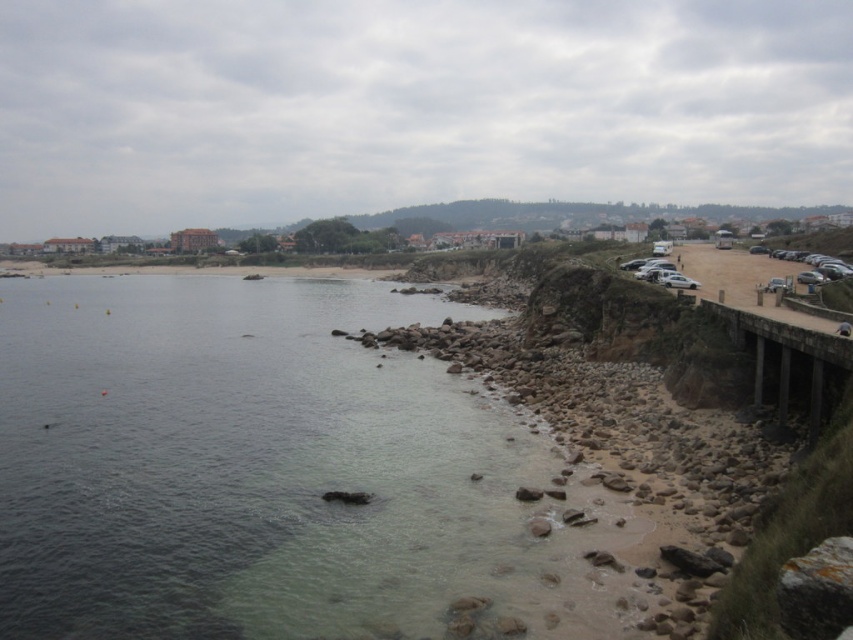
Question: In this image, where is clear water at lower left located relative to concrete bridge at right?

Choices:
 (A) right
 (B) left

Answer: (B)

Question: Does clear water at lower left appear on the right side of concrete bridge at right?

Choices:
 (A) yes
 (B) no

Answer: (B)

Question: Is clear water at lower left to the left of concrete bridge at right from the viewer's perspective?

Choices:
 (A) yes
 (B) no

Answer: (A)

Question: Among these objects, which one is nearest to the camera?

Choices:
 (A) clear water at lower left
 (B) concrete bridge at right

Answer: (A)

Question: Which point is closer to the camera?

Choices:
 (A) clear water at lower left
 (B) concrete bridge at right

Answer: (A)